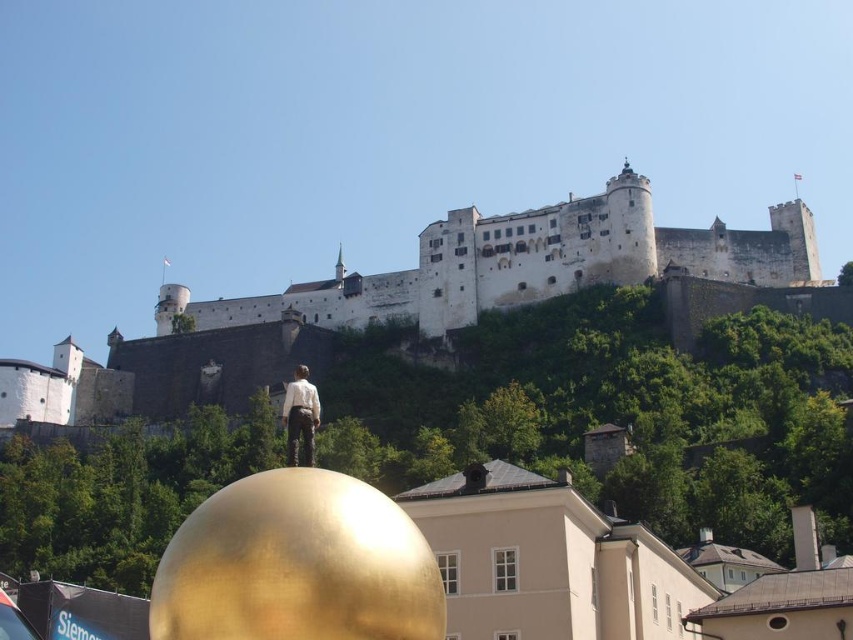
Is white stone castle at upper center positioned behind matte white shirt at center?

Yes.

Which of these two, white stone castle at upper center or matte white shirt at center, stands taller?

With more height is white stone castle at upper center.

Is point (683, 248) less distant than point (305, 456)?

No, (683, 248) is further to viewer.

Find the location of `white stone castle at upper center`. white stone castle at upper center is located at coordinates (526, 264).